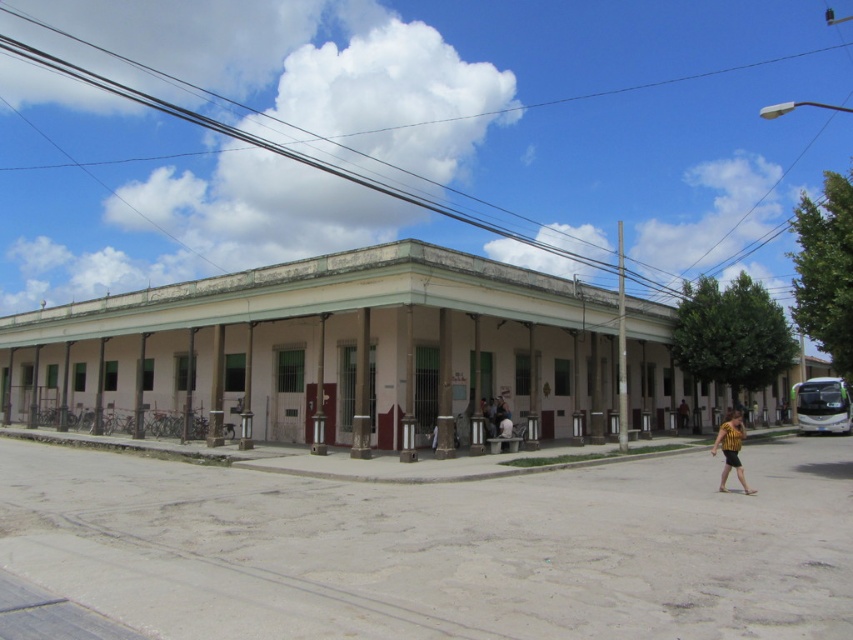
You are a delivery person standing at the entrance of the two story building with a red door. You see a yellow striped shirt at lower right and a brown leather jacket at lower right. Can you safely place a large package between them without it touching either?

The distance between the yellow striped shirt at lower right and brown leather jacket at lower right is 5.34 meters. Since the package is large but not specified in size, it depends on the package dimensions. However, given the significant space, it is likely safe to place it there without touching either item.

You are standing at the center of the building and want to locate the yellow striped shirt at lower right. According to the coordinates provided, in which direction should you move to find it?

The yellow striped shirt at lower right is located at coordinates point (730, 449). Since you are at the center of the building, you should move towards the lower right direction to find it.

You are standing in front of the two story building and see a yellow striped shirt at lower right and a brown leather jacket at lower right. Which clothing item is wider?

The yellow striped shirt at lower right is wider than the brown leather jacket at lower right according to the description.